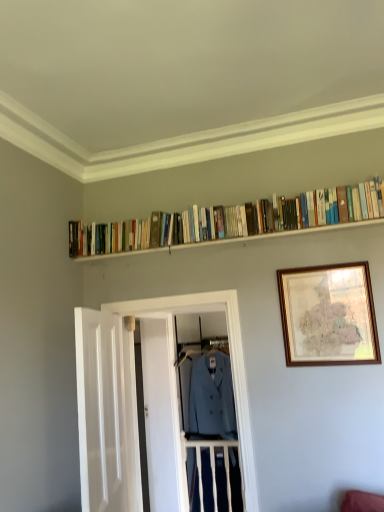
Question: From the image's perspective, is white wooden door at left, the first door when ordered from front to back, located above matte blue coat at center?

Choices:
 (A) no
 (B) yes

Answer: (B)

Question: From a real-world perspective, is white wooden door at left, positioned as the 2th door in back-to-front order, positioned under matte blue coat at center based on gravity?

Choices:
 (A) no
 (B) yes

Answer: (B)

Question: Considering the relative sizes of white wooden door at left, the first door when ordered from front to back, and matte blue coat at center in the image provided, is white wooden door at left, the first door when ordered from front to back, thinner than matte blue coat at center?

Choices:
 (A) no
 (B) yes

Answer: (B)

Question: Is white wooden door at left, the first door when ordered from front to back, positioned behind matte blue coat at center?

Choices:
 (A) yes
 (B) no

Answer: (B)

Question: Is white wooden door at left, positioned as the 2th door in back-to-front order, to the right of matte blue coat at center from the viewer's perspective?

Choices:
 (A) no
 (B) yes

Answer: (A)

Question: Is the position of white wooden door at left, the first door when ordered from front to back, less distant than that of matte blue coat at center?

Choices:
 (A) no
 (B) yes

Answer: (B)

Question: Is white wooden door at left, the first door when ordered from front to back, positioned far away from white wooden door at center, the 2th door from the front?

Choices:
 (A) no
 (B) yes

Answer: (B)

Question: Is white wooden door at left, the first door when ordered from front to back, taller than white wooden door at center, the 2th door from the front?

Choices:
 (A) no
 (B) yes

Answer: (A)

Question: Is white wooden door at left, the first door when ordered from front to back, thinner than white wooden door at center, the 2th door from the front?

Choices:
 (A) no
 (B) yes

Answer: (B)

Question: Is white wooden door at left, the first door when ordered from front to back, beside white wooden door at center, the 2th door from the front?

Choices:
 (A) yes
 (B) no

Answer: (B)

Question: Does white wooden door at left, the first door when ordered from front to back, have a greater width compared to white wooden door at center, the 2th door from the front?

Choices:
 (A) yes
 (B) no

Answer: (B)

Question: From the image's perspective, is white wooden door at left, positioned as the 2th door in back-to-front order, over white wooden door at center, the 2th door from the front?

Choices:
 (A) yes
 (B) no

Answer: (A)

Question: Would you say white wooden door at left, positioned as the 2th door in back-to-front order, is outside hardcover books at upper center?

Choices:
 (A) no
 (B) yes

Answer: (B)